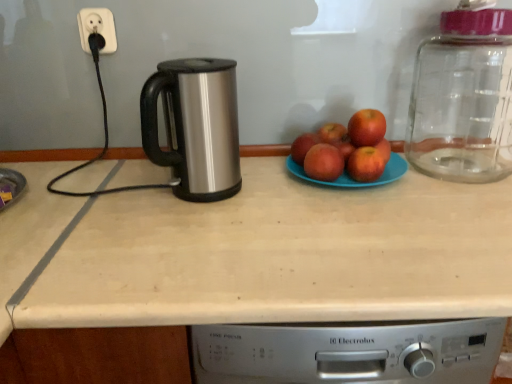
Where is `free space above beige laminate countertop at center (from a real-world perspective)`? free space above beige laminate countertop at center (from a real-world perspective) is located at coordinates coord(264,216).